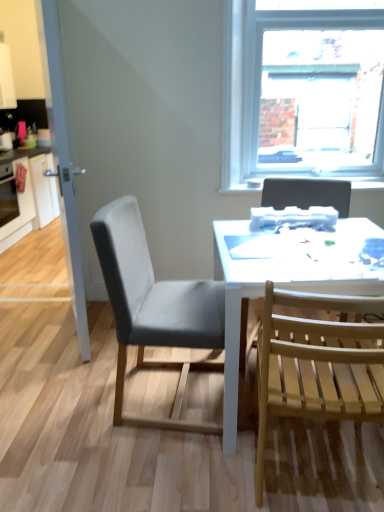
What do you see at coordinates (6, 141) in the screenshot?
I see `matte pink coffee cup at left` at bounding box center [6, 141].

At what (x,y) coordinates should I click in order to perform the action: click on brushed metal oven at left. Please return your answer as a coordinate pair (x, y). Image resolution: width=384 pixels, height=512 pixels. Looking at the image, I should click on (8, 195).

The width and height of the screenshot is (384, 512). In order to click on white plastic printer at upper center in this screenshot , I will do `click(293, 218)`.

I want to click on cabinetry directly beneath the matte pink coffee cup at left (from a real-world perspective), so click(x=28, y=196).

Looking at this image, from a real-world perspective, is white glossy cabinet at left on top of matte pink coffee cup at left?

Incorrect, from a real-world perspective, white glossy cabinet at left is lower than matte pink coffee cup at left.

Could you tell me if white glossy cabinet at left is turned towards matte pink coffee cup at left?

No, white glossy cabinet at left is not aimed at matte pink coffee cup at left.

Measure the distance between clear glass window at upper center and white plastic printer at upper center.

A distance of 35.37 inches exists between clear glass window at upper center and white plastic printer at upper center.

Which object is thinner, clear glass window at upper center or white plastic printer at upper center?

Thinner between the two is white plastic printer at upper center.

Find the location of a particular element. The height and width of the screenshot is (512, 384). appliance beneath the clear glass window at upper center (from a real-world perspective) is located at coordinates (293, 218).

What's the angular difference between clear glass window at upper center and white plastic printer at upper center's facing directions?

There is a 2.34-degree angle between the facing directions of clear glass window at upper center and white plastic printer at upper center.

Is white plastic printer at upper center positioned far away from matte pink coffee cup at left?

Yes, white plastic printer at upper center and matte pink coffee cup at left are quite far apart.

Is white plastic printer at upper center smaller than matte pink coffee cup at left?

Yes.

Does point (331, 211) come farther from viewer compared to point (6, 133)?

No, it is not.

Do you think gray fabric chair at center, which is the 3th chair from right to left, is within matte pink coffee cup at left, or outside of it?

gray fabric chair at center, which is the 3th chair from right to left, is spatially situated outside matte pink coffee cup at left.

Considering the positions of points (145, 337) and (10, 137), is point (145, 337) closer to camera compared to point (10, 137)?

Yes, point (145, 337) is closer to viewer.

Considering the sizes of clear glass window at upper center and white glossy cabinet at left in the image, is clear glass window at upper center bigger or smaller than white glossy cabinet at left?

clear glass window at upper center is smaller than white glossy cabinet at left.

Which is behind, clear glass window at upper center or white glossy cabinet at left?

white glossy cabinet at left.

How much distance is there between clear glass window at upper center and white glossy cabinet at left?

3.17 meters.

Is clear glass window at upper center not within white glossy cabinet at left?

Yes.

From the image's perspective, would you say matte pink coffee cup at left is positioned over clear glass door at left?

Indeed, from the image's perspective, matte pink coffee cup at left is shown above clear glass door at left.

From a real-world perspective, is matte pink coffee cup at left positioned under clear glass door at left based on gravity?

Correct, in the physical world, matte pink coffee cup at left is lower than clear glass door at left.

Consider the image. Which object is positioned more to the left, matte pink coffee cup at left or clear glass door at left?

matte pink coffee cup at left is more to the left.

Is matte pink coffee cup at left wider than clear glass door at left?

Yes.

From the picture: Considering the relative positions of white plastic printer at upper center and clear glass door at left in the image provided, is white plastic printer at upper center to the right of clear glass door at left from the viewer's perspective?

Yes, white plastic printer at upper center is to the right of clear glass door at left.

What's the angular difference between white plastic printer at upper center and clear glass door at left's facing directions?

white plastic printer at upper center and clear glass door at left are facing 67.5 degrees away from each other.

Based on the photo, is white plastic printer at upper center placed right next to clear glass door at left?

There is a gap between white plastic printer at upper center and clear glass door at left.

Considering the relative positions of white plastic printer at upper center and clear glass door at left in the image provided, is white plastic printer at upper center behind clear glass door at left?

Yes, white plastic printer at upper center is further from the camera.

The height and width of the screenshot is (512, 384). I want to click on cabinetry in front of the matte pink coffee cup at left, so click(x=28, y=196).

Where is `appliance lying on the left of clear glass window at upper center`? Image resolution: width=384 pixels, height=512 pixels. appliance lying on the left of clear glass window at upper center is located at coordinates click(x=293, y=218).

Estimate the real-world distances between objects in this image. Which object is closer to white glossy desk at center, gray fabric chair at center, marked as the first chair in a left-to-right arrangement, or clear glass window at upper center?

Among the two, gray fabric chair at center, marked as the first chair in a left-to-right arrangement, is located nearer to white glossy desk at center.

From the image, which object appears to be farther from white glossy desk at center, light wood slats chair at right, the second chair positioned from the left, or white plastic printer at upper center?

The object further to white glossy desk at center is white plastic printer at upper center.

Based on their spatial positions, is brushed metal oven at left or white plastic printer at upper center closer to matte pink coffee cup at left?

brushed metal oven at left lies closer to matte pink coffee cup at left than the other object.

Looking at the image, which one is located closer to white glossy desk at center, gray fabric chair at center, marked as the first chair in a left-to-right arrangement, or matte pink coffee cup at left?

gray fabric chair at center, marked as the first chair in a left-to-right arrangement.

Considering their positions, is brushed metal oven at left positioned further to light wood slats chair at right, which is the 2th chair from right to left, than clear glass door at left?

The object further to light wood slats chair at right, which is the 2th chair from right to left, is brushed metal oven at left.

When comparing their distances from matte pink coffee cup at left, does light wood slats chair at right, the second chair positioned from the left, or brushed metal oven at left seem closer?

The object closer to matte pink coffee cup at left is brushed metal oven at left.

Estimate the real-world distances between objects in this image. Which object is further from light wood slats chair at right, which is the 2th chair from right to left, clear glass window at upper center or white plastic printer at upper center?

Among the two, clear glass window at upper center is located further to light wood slats chair at right, which is the 2th chair from right to left.

Based on the photo, which object lies nearer to the anchor point white glossy cabinet at left, white glossy desk at center or white plastic printer at upper center?

Based on the image, white plastic printer at upper center appears to be nearer to white glossy cabinet at left.

Image resolution: width=384 pixels, height=512 pixels. I want to click on chair between gray fabric chair at center, which is the 3th chair from right to left, and matte pink coffee cup at left in the front-back direction, so click(307, 194).

You are a GUI agent. You are given a task and a screenshot of the screen. Output one action in this format:
    pyautogui.click(x=<x>, y=<y>)
    Task: Click on the kitchen appliance between white plastic printer at upper center and white glossy cabinet at left from front to back
    This screenshot has width=384, height=512.
    Given the screenshot: What is the action you would take?
    pyautogui.click(x=8, y=195)

The height and width of the screenshot is (512, 384). Identify the location of cabinetry located between wooden slats chair at right, the first chair from the right, and matte pink coffee cup at left in the depth direction. (28, 196).

Where is `window positioned between white plastic printer at upper center and white glossy cabinet at left from near to far`? Image resolution: width=384 pixels, height=512 pixels. window positioned between white plastic printer at upper center and white glossy cabinet at left from near to far is located at coordinates (302, 89).